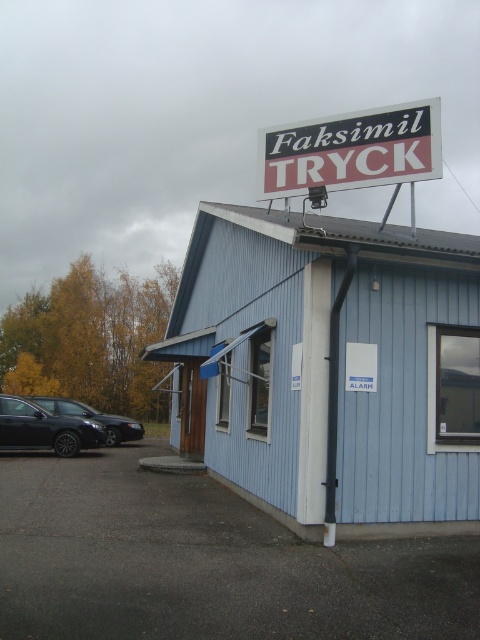
Question: Can you confirm if gray asphalt parking lot at lower left is thinner than matte black car at left?

Choices:
 (A) yes
 (B) no

Answer: (B)

Question: Which point is closer to the camera?

Choices:
 (A) (416, 172)
 (B) (81, 413)

Answer: (A)

Question: Which of the following is the closest to the observer?

Choices:
 (A) gray asphalt parking lot at lower left
 (B) black plastic sign at upper center
 (C) matte black car at left

Answer: (A)

Question: Which object is closer to the camera taking this photo?

Choices:
 (A) black plastic sign at upper center
 (B) gray asphalt parking lot at lower left
 (C) matte black car at left

Answer: (B)

Question: Does gray asphalt parking lot at lower left appear over matte black car at left?

Choices:
 (A) no
 (B) yes

Answer: (B)

Question: Considering the relative positions of gray asphalt parking lot at lower left and matte black car at left in the image provided, where is gray asphalt parking lot at lower left located with respect to matte black car at left?

Choices:
 (A) above
 (B) below

Answer: (A)